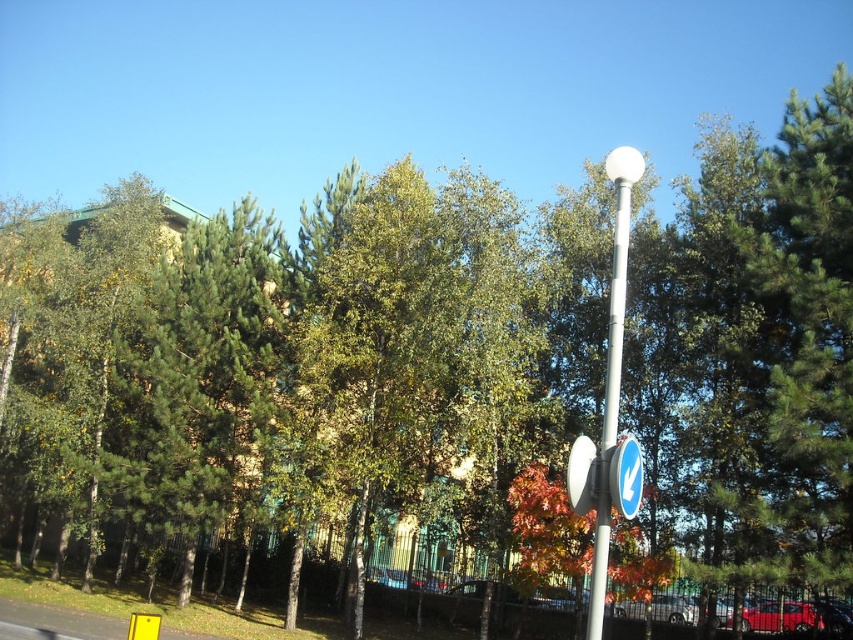
Question: Is blue glossy traffic sign at center right positioned before white glossy traffic sign at center-right?

Choices:
 (A) no
 (B) yes

Answer: (B)

Question: Which point is closer to the camera?

Choices:
 (A) (575, 461)
 (B) (587, 481)

Answer: (B)

Question: Is white glossy lamp post at upper right below white glossy traffic sign at center-right?

Choices:
 (A) no
 (B) yes

Answer: (B)

Question: Which of the following is the farthest from the observer?

Choices:
 (A) (575, 470)
 (B) (621, 456)
 (C) (630, 513)

Answer: (A)

Question: Does white glossy lamp post at upper right have a lesser width compared to blue glossy traffic sign at upper center?

Choices:
 (A) no
 (B) yes

Answer: (A)

Question: Which point appears farthest from the camera in this image?

Choices:
 (A) (577, 454)
 (B) (576, 497)
 (C) (616, 307)

Answer: (C)